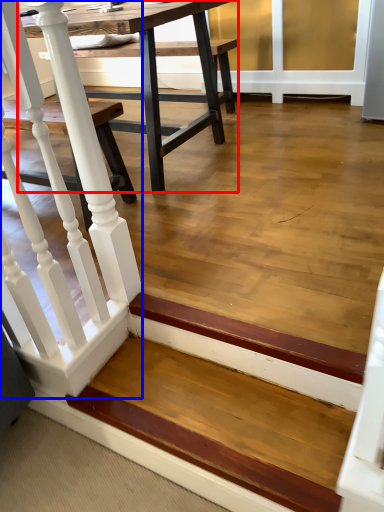
Question: Which object is closer to the camera taking this photo, table (highlighted by a red box) or rail (highlighted by a blue box)?

Choices:
 (A) table
 (B) rail

Answer: (B)